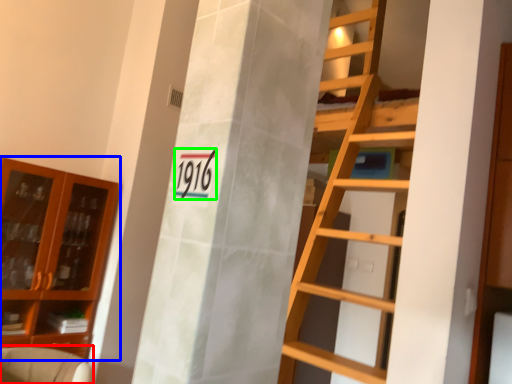
Question: Which is nearer to the armchair (highlighted by a red box)? cabinetry (highlighted by a blue box) or number (highlighted by a green box).

Choices:
 (A) cabinetry
 (B) number

Answer: (A)